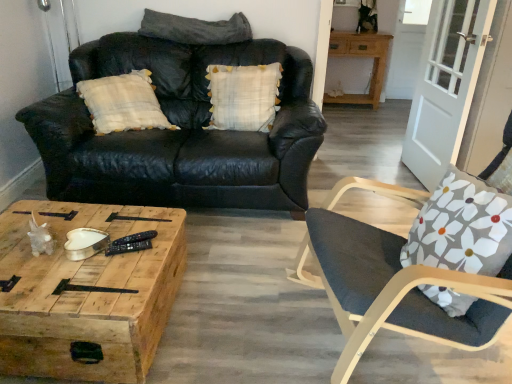
Question: From the image's perspective, is wooden table at upper right positioned above or below black leather couch at upper left?

Choices:
 (A) below
 (B) above

Answer: (B)

Question: Considering the positions of wooden table at upper right and black leather couch at upper left in the image, is wooden table at upper right taller or shorter than black leather couch at upper left?

Choices:
 (A) short
 (B) tall

Answer: (A)

Question: Which object is the closest to the wooden table at upper right?

Choices:
 (A) gray fabric pillow at upper center, the first pillow viewed from the top
 (B) woodenwoodencoffee table at lower left
 (C) black leather couch at upper left
 (D) white wood screen door at right
 (E) white plaid pillow at center, which ranks as the 2th pillow in top-to-bottom order

Answer: (D)

Question: Which of these objects is positioned closest to the gray fabric pillow at upper center, positioned as the second pillow in bottom-to-top order?

Choices:
 (A) white plaid pillow at center, which ranks as the 2th pillow in top-to-bottom order
 (B) dark gray fabric chair at right
 (C) white wood screen door at right
 (D) black leather couch at upper left
 (E) wooden table at upper right

Answer: (A)